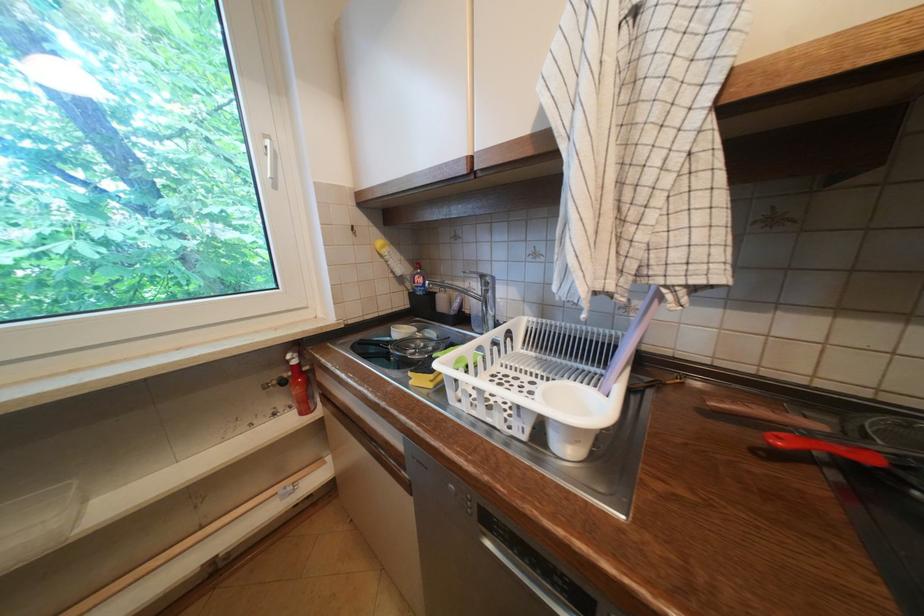
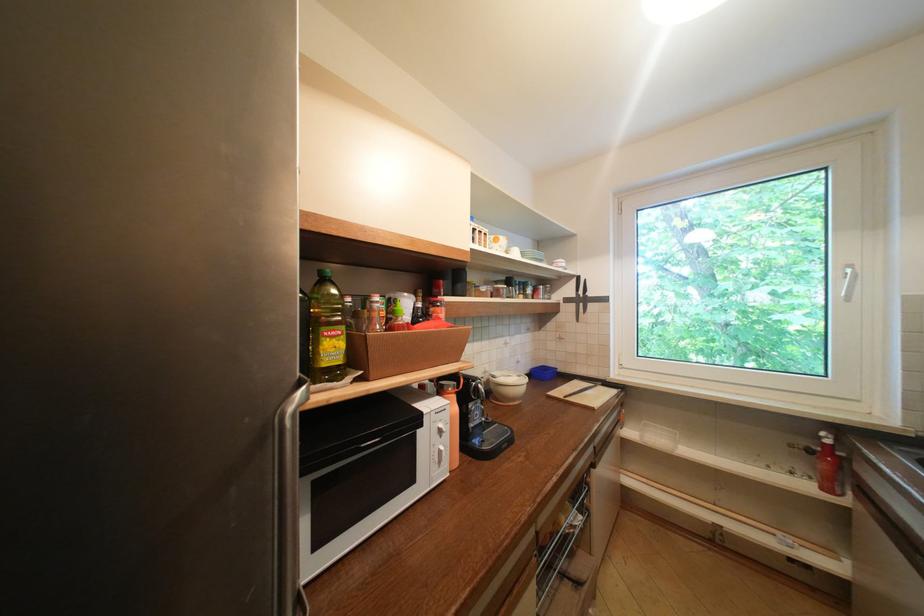
The point at (296, 362) is marked in the first image. Where is the corresponding point in the second image?

(829, 439)